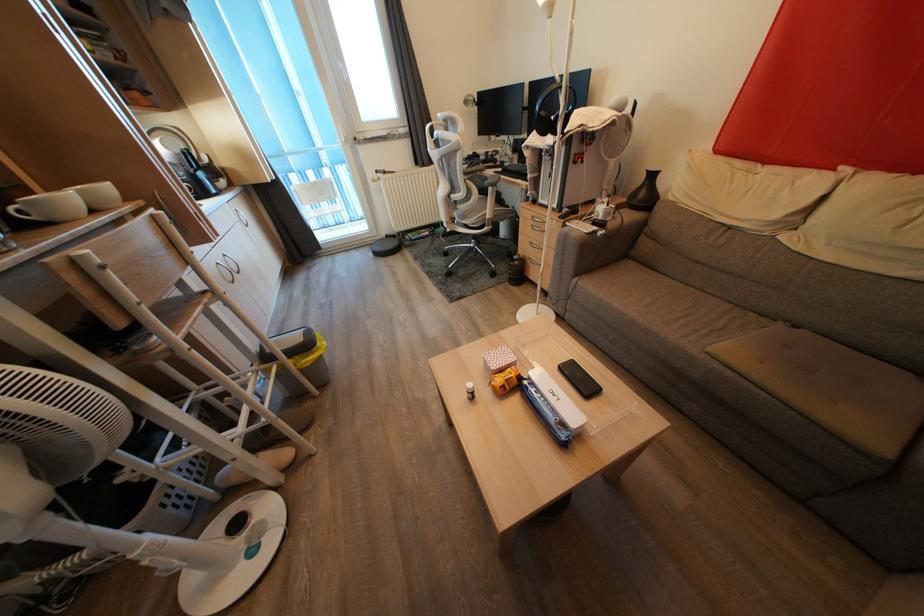
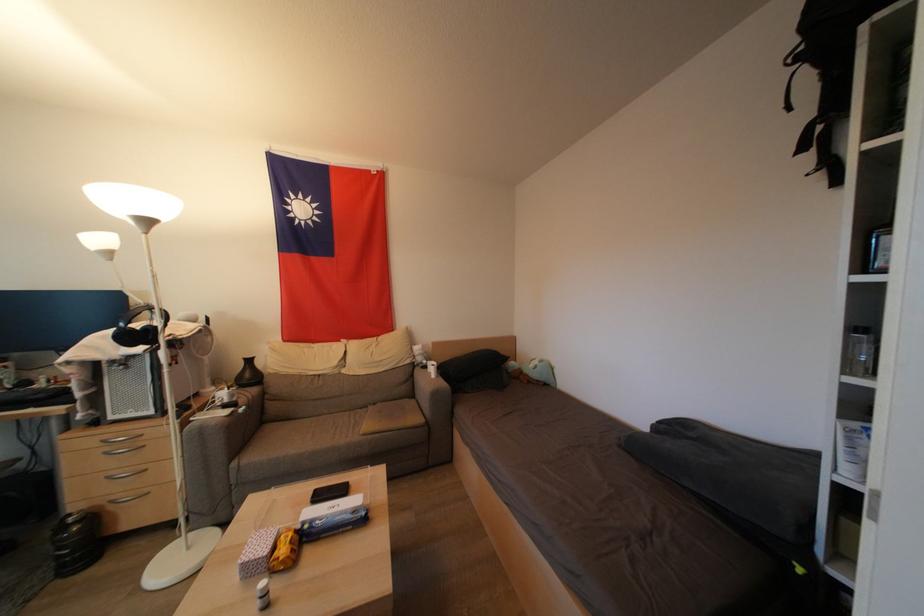
In the second image, find the point that corresponds to the point at 539,219 in the first image.

(112, 440)